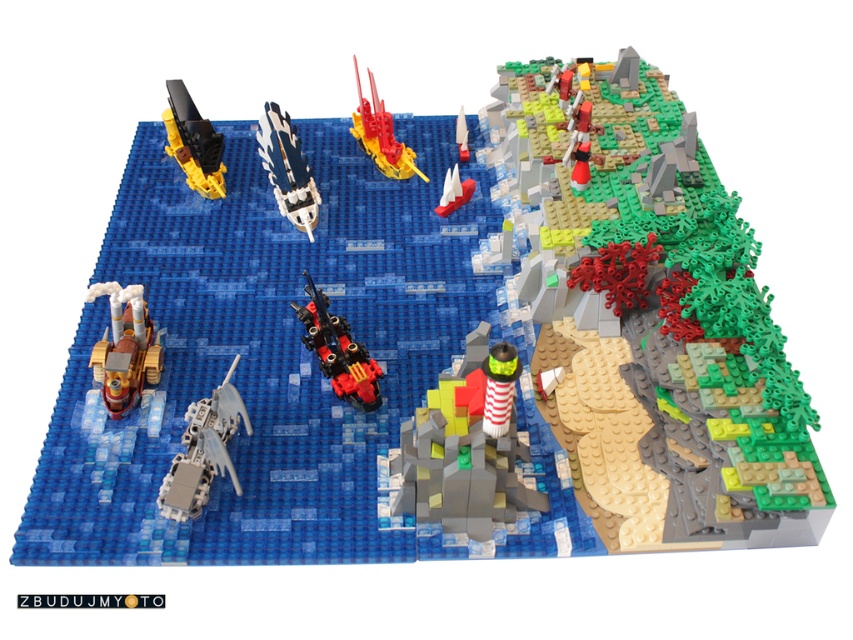
Consider the image. You are a Lego pirate captain navigating your ship through the nautical scene. You see the red and white striped lighthouse at center and the smooth red boat at center. Which object is positioned lower in the scene?

The red and white striped lighthouse at center is located below the smooth red boat at center, so it is positioned lower in the scene.

You are a Lego figure standing on the smooth green rock at upper right and want to reach the white plastic sailboat at center. Since you can only move downward, can you do so without jumping?

The smooth green rock at upper right is bigger than the white plastic sailboat at center, so yes, you can move downward from the smooth green rock at upper right to the white plastic sailboat at center without jumping.

You are a toy collector who wants to place a new 15 cm long Lego ship in the diorama. You have space between the shiny yellow plastic submarine at upper left and the white plastic sailboat at center. Can you fit the new ship there?

The distance between the shiny yellow plastic submarine at upper left and the white plastic sailboat at center is 32.44 centimeters, which is more than enough to accommodate the new 15 cm long Lego ship.